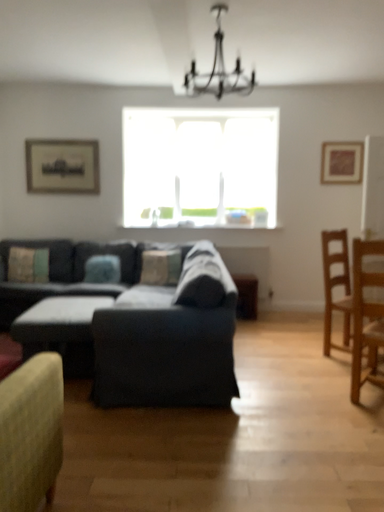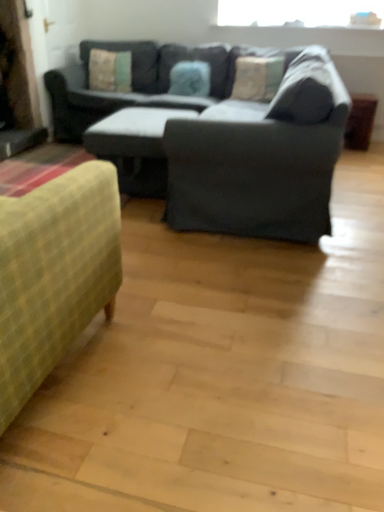
Question: How did the camera likely rotate when shooting the video?

Choices:
 (A) rotated right
 (B) rotated left

Answer: (B)